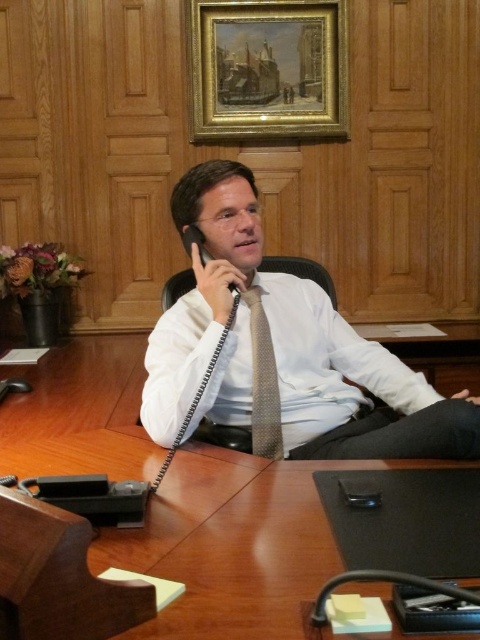
You are organizing a desk and need to place the black plastic smartphone at lower center and the black plastic phone at center into a drawer. The drawer has a height limit of 1 cm. Which device can fit vertically in the drawer?

The black plastic smartphone at lower center is thinner than the black plastic phone at center, so the smartphone can fit vertically in the drawer since it meets the 1 cm height limit.

You are a photographer taking a picture of the desk from the camera position. There are two points on the desk labeled as point (228, 618) and point (204, 250). Which point will appear larger in the photo?

Point (228, 618) is closer to the camera than point (204, 250), so it will appear larger in the photo.

You are an office assistant who needs to place a new document on the desk. The document requires a signature, and you need to ensure there is enough space between the black plastic smartphone at lower center and the black plastic phone at center to place it. Can you fit the document between them?

The black plastic smartphone at lower center is not as tall as the black plastic phone at center, so there might be enough space between them to place the document. However, the exact dimensions of the document and the distance between the two devices are needed to confirm.